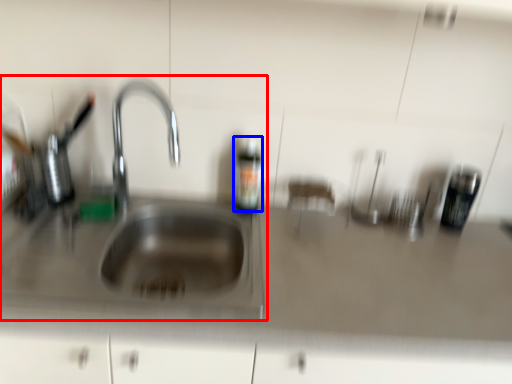
Question: Which of the following is the closest to the observer, sink (highlighted by a red box) or bottle (highlighted by a blue box)?

Choices:
 (A) sink
 (B) bottle

Answer: (A)